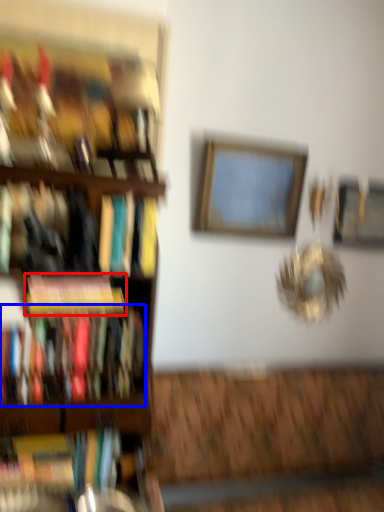
Question: Among these objects, which one is nearest to the camera, book (highlighted by a red box) or book (highlighted by a blue box)?

Choices:
 (A) book
 (B) book

Answer: (B)